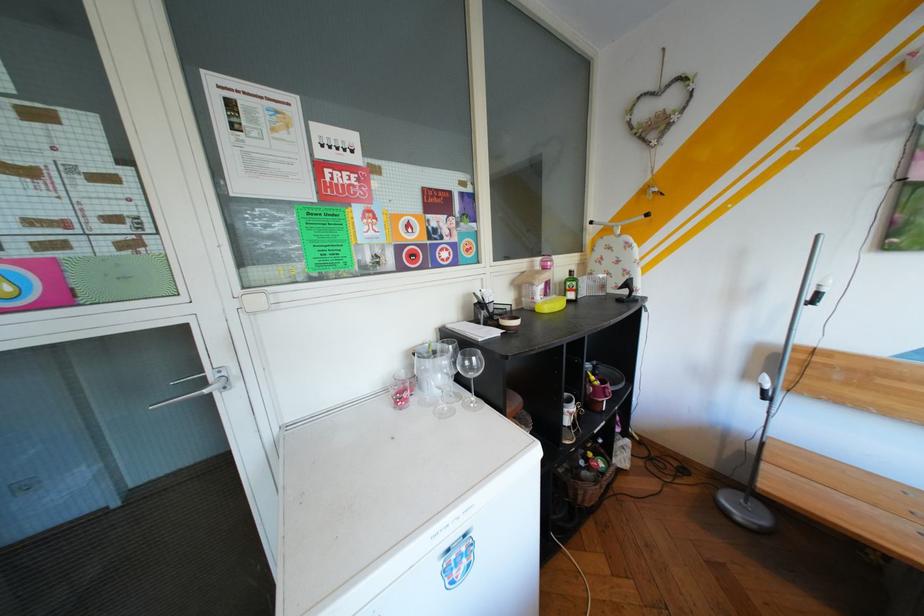
What do you see at coordinates (407, 514) in the screenshot? The height and width of the screenshot is (616, 924). I see `a white freezer lid` at bounding box center [407, 514].